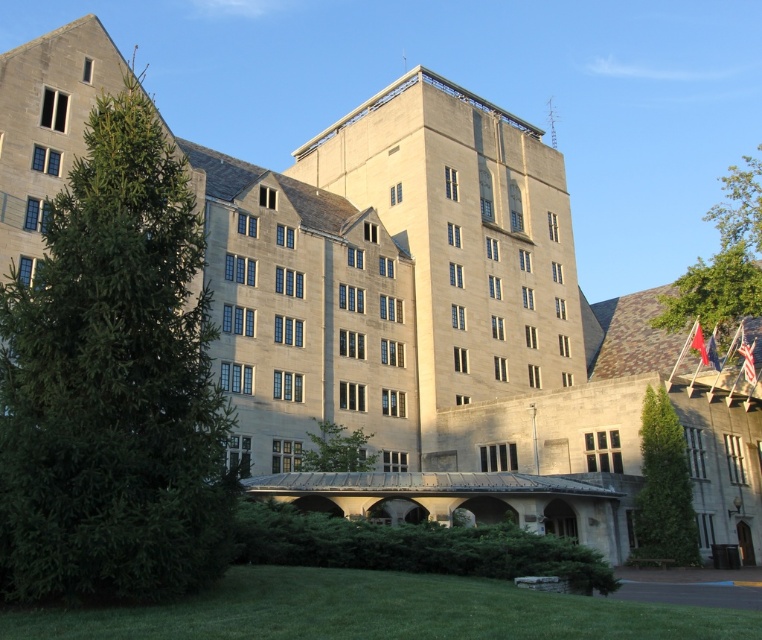
Consider the image. Which of these two, green leafy tree at left or green leafy tree at lower right, stands shorter?

green leafy tree at lower right

Between green leafy tree at left and green leafy tree at lower right, which one is positioned higher?

Positioned higher is green leafy tree at left.

Is point (122, 381) closer to camera compared to point (676, 456)?

Yes, point (122, 381) is in front of point (676, 456).

I want to click on green leafy tree at left, so click(x=114, y=381).

Can you confirm if green leafy tree at left is taller than green leafy tree at center?

Yes, green leafy tree at left is taller than green leafy tree at center.

Is point (37, 458) more distant than point (357, 470)?

That is False.

Does point (125, 134) come closer to viewer compared to point (347, 449)?

Yes, it is.

You are a GUI agent. You are given a task and a screenshot of the screen. Output one action in this format:
    pyautogui.click(x=<x>, y=<y>)
    Task: Click on the green leafy tree at left
    This screenshot has width=762, height=640.
    Given the screenshot: What is the action you would take?
    pyautogui.click(x=114, y=381)

Measure the distance between point (693, 316) and camera.

62.33 meters

You are a GUI agent. You are given a task and a screenshot of the screen. Output one action in this format:
    pyautogui.click(x=<x>, y=<y>)
    Task: Click on the green leafy tree at upper right
    The image size is (762, 640).
    Given the screenshot: What is the action you would take?
    pyautogui.click(x=722, y=260)